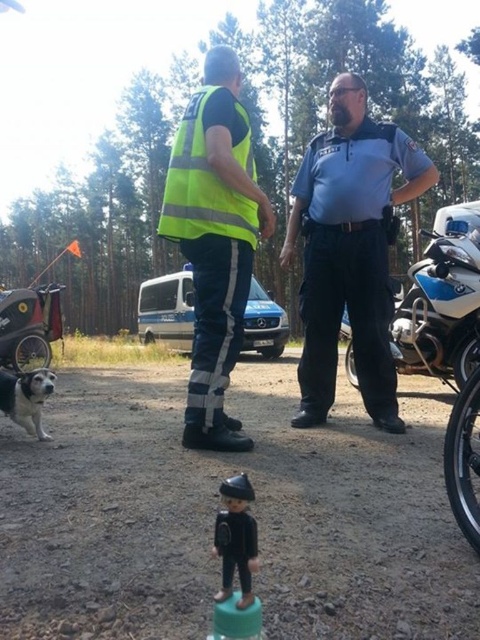
You are a delivery robot with a height of 1.5 meters. You are positioned in the scene and need to reach the green rubber toy at center. Considering your height, can you safely navigate to the toy without hitting your head on any objects?

The green rubber toy at center is 1.08 meters away from the camera. Since the robot is 1.5 meters tall and the distance to the toy is only 1.08 meters, the robot may not have enough space to reach the toy without potentially hitting its head on nearby objects. However, without additional information about obstacles or ceiling height in the scene, it is difficult to determine safety with certainty.